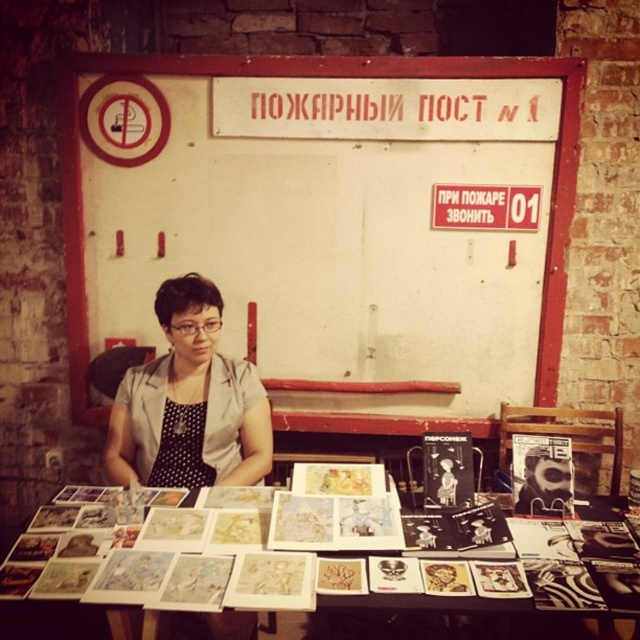
At what (x,y) coordinates should I click in order to perform the action: click on white matte board at upper center. Please return your answer as a coordinate pair (x, y). The image size is (640, 640). Looking at the image, I should click on (317, 76).

Who is lower down, white matte board at upper center or gray dotted dress at center?

gray dotted dress at center

Is point (61, 198) in front of point (188, 348)?

That is False.

Identify the location of white matte board at upper center. The height and width of the screenshot is (640, 640). (317, 76).

Who is lower down, white matte board at upper center or white paper at center?

white paper at center is lower down.

From the picture: Can you confirm if white matte board at upper center is positioned to the left of white paper at center?

Correct, you'll find white matte board at upper center to the left of white paper at center.

Does point (410, 74) come behind point (387, 636)?

Yes, point (410, 74) is farther from viewer.

Find the location of a particular element. white matte board at upper center is located at coordinates (317, 76).

Who is taller, white matte board at upper center or black dotted fabric apron at center?

Standing taller between the two is white matte board at upper center.

Between white matte board at upper center and black dotted fabric apron at center, which one has less height?

black dotted fabric apron at center is shorter.

This screenshot has height=640, width=640. Find the location of `white matte board at upper center`. white matte board at upper center is located at coordinates coord(317,76).